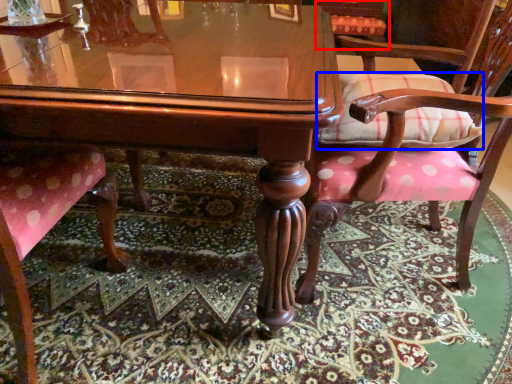
Question: Which of the following is the closest to the observer, chair (highlighted by a red box) or pillow (highlighted by a blue box)?

Choices:
 (A) chair
 (B) pillow

Answer: (B)